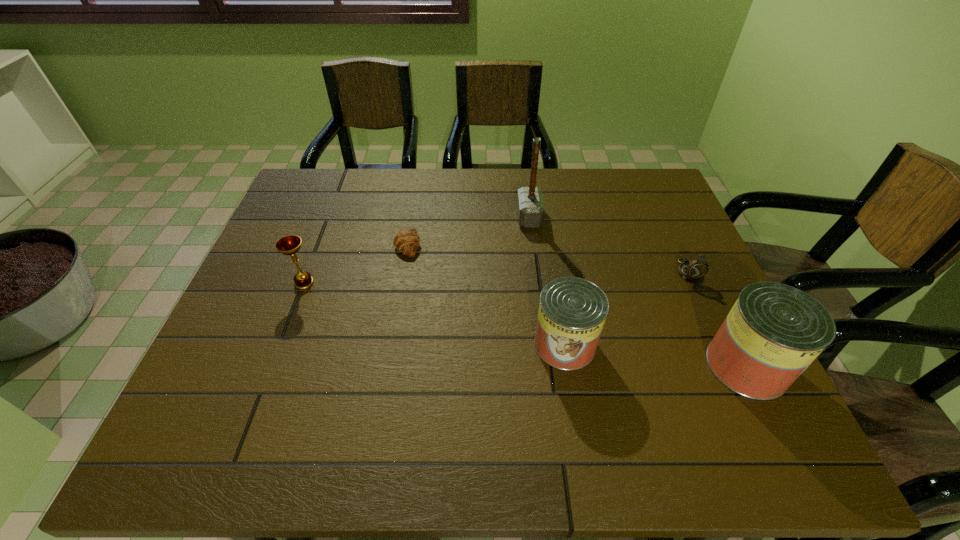
You are a GUI agent. You are given a task and a screenshot of the screen. Output one action in this format:
    pyautogui.click(x=<x>, y=<y>)
    Task: Click on the vacant area situated 0.210m on the left of the right can
    The image size is (960, 540).
    Given the screenshot: What is the action you would take?
    pyautogui.click(x=612, y=366)

Where is `free spot located 0.120m on the striking surface of the hammer`? This screenshot has width=960, height=540. free spot located 0.120m on the striking surface of the hammer is located at coordinates (478, 217).

At what (x,y) coordinates should I click in order to perform the action: click on vacant region located 0.250m on the striking surface of the hammer. Please return your answer as a coordinate pair (x, y). Looking at the image, I should click on (435, 217).

Locate an element on the screen. The image size is (960, 540). free space located 0.210m on the striking surface of the hammer is located at coordinates (448, 217).

Image resolution: width=960 pixels, height=540 pixels. I want to click on vacant point located 0.340m on the right of the leftmost object, so click(x=447, y=283).

The width and height of the screenshot is (960, 540). I want to click on vacant space situated on the left of the shortest object, so click(x=346, y=244).

Locate an element on the screen. free point located 0.170m on the face of the compass is located at coordinates (717, 336).

Where is `object that is at the far edge`? object that is at the far edge is located at coordinates (530, 204).

Locate an element on the screen. object located at the left edge is located at coordinates (288, 245).

Locate an element on the screen. The width and height of the screenshot is (960, 540). can that is at the right edge is located at coordinates (774, 331).